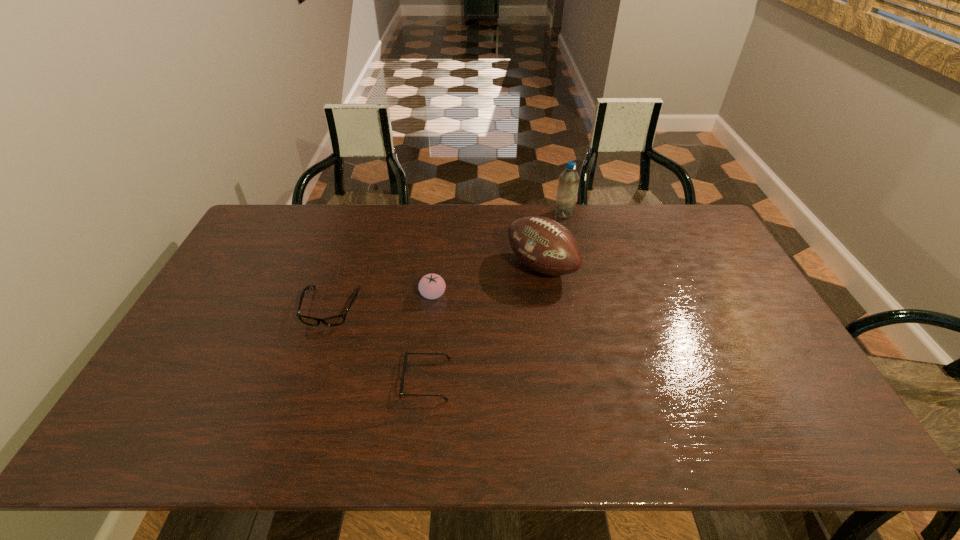
You are a GUI agent. You are given a task and a screenshot of the screen. Output one action in this format:
    pyautogui.click(x=<x>, y=<y>)
    Task: Click on the water bottle
    The image size is (960, 540).
    Given the screenshot: What is the action you would take?
    pyautogui.click(x=567, y=191)

You are a GUI agent. You are given a task and a screenshot of the screen. Output one action in this format:
    pyautogui.click(x=<x>, y=<y>)
    Task: Click on the fourth shortest object
    
    Given the screenshot: What is the action you would take?
    pyautogui.click(x=544, y=245)

The width and height of the screenshot is (960, 540). I want to click on the third shortest object, so click(x=431, y=286).

Where is `the leftmost object`? The width and height of the screenshot is (960, 540). the leftmost object is located at coordinates (337, 320).

Where is `the second shortest object`? The height and width of the screenshot is (540, 960). the second shortest object is located at coordinates (337, 320).

Where is `the nearer spectacles`? the nearer spectacles is located at coordinates (401, 394).

Locate an element on the screen. the right spectacles is located at coordinates (401, 394).

The height and width of the screenshot is (540, 960). I want to click on free point located 0.380m on the right of the water bottle, so click(676, 213).

I want to click on vacant region located on the right of the fourth shortest object, so click(618, 267).

At what (x,y) coordinates should I click in order to perform the action: click on vacant region located on the front of the tomato. Please return your answer as a coordinate pair (x, y). The height and width of the screenshot is (540, 960). Looking at the image, I should click on (430, 317).